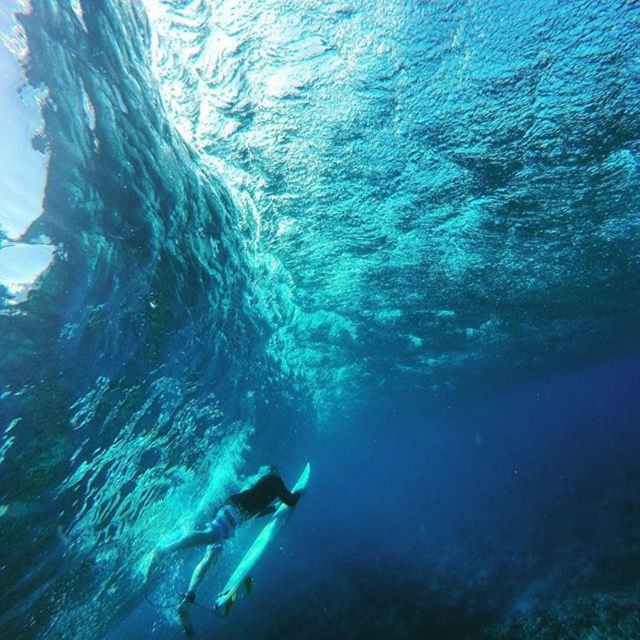
Looking at this image, you are a marine biologist observing an underwater scene. You notice a smooth skin diver at lower center and a white glossy surfboard at lower center. Which object is shorter in height?

The smooth skin diver at lower center is shorter in height compared to the white glossy surfboard at lower center.

You are a scuba diver planning to swim towards the point marked at coordinates point (248, 499). Given that you can swim 10 feet per minute, how many minutes will it take you to reach the point from your current position?

The distance between you and the point (248, 499) is 27.62 feet. At a swimming speed of 10 feet per minute, it will take approximately 2.76 minutes to reach the point.

You are a marine biologist observing an underwater scene. You notice a smooth skin diver at lower center. Based on their position, can you determine if they are closer to the surface or the ocean floor?

The smooth skin diver at lower center is positioned at point coordinates of 0.836 on the x axis and 0.362 on the y axis. Since the y coordinate is closer to 0, which represents the top of the image, they are closer to the surface than the ocean floor.